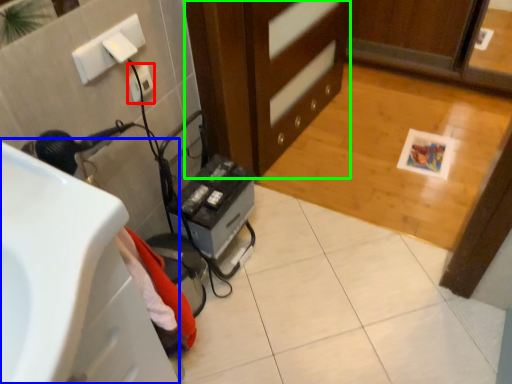
Question: Which object is the closest to the electric outlet (highlighted by a red box)? Choose among these: sink (highlighted by a blue box) or cabinetry (highlighted by a green box).

Choices:
 (A) sink
 (B) cabinetry

Answer: (B)